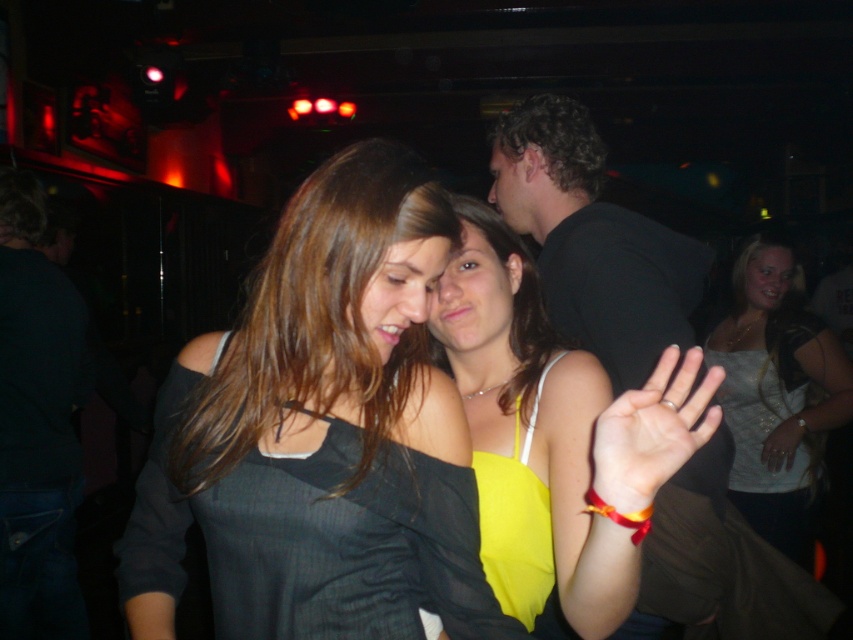
Question: Is matte black dress at center to the left of smooth yellow fabric at center from the viewer's perspective?

Choices:
 (A) yes
 (B) no

Answer: (A)

Question: Can you confirm if smooth yellow fabric at center is positioned to the right of metallic silver ring at center?

Choices:
 (A) yes
 (B) no

Answer: (B)

Question: Which is nearer to the smooth yellow fabric at center?

Choices:
 (A) matte black dress at center
 (B) metallic silver ring at center

Answer: (A)

Question: Among these points, which one is farthest from the camera?

Choices:
 (A) (715, 369)
 (B) (492, 365)
 (C) (780, 461)

Answer: (C)

Question: Which point is closer to the camera?

Choices:
 (A) smooth yellow fabric at center
 (B) matte black dress at center
 (C) shiny silver tank top at center

Answer: (A)

Question: Is the position of matte black dress at center less distant than that of metallic silver ring at center?

Choices:
 (A) yes
 (B) no

Answer: (A)